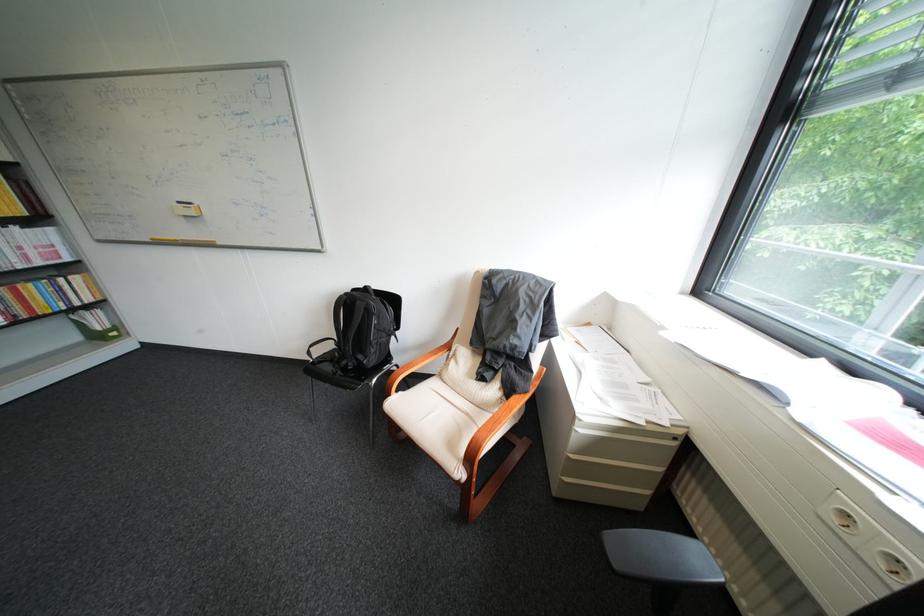
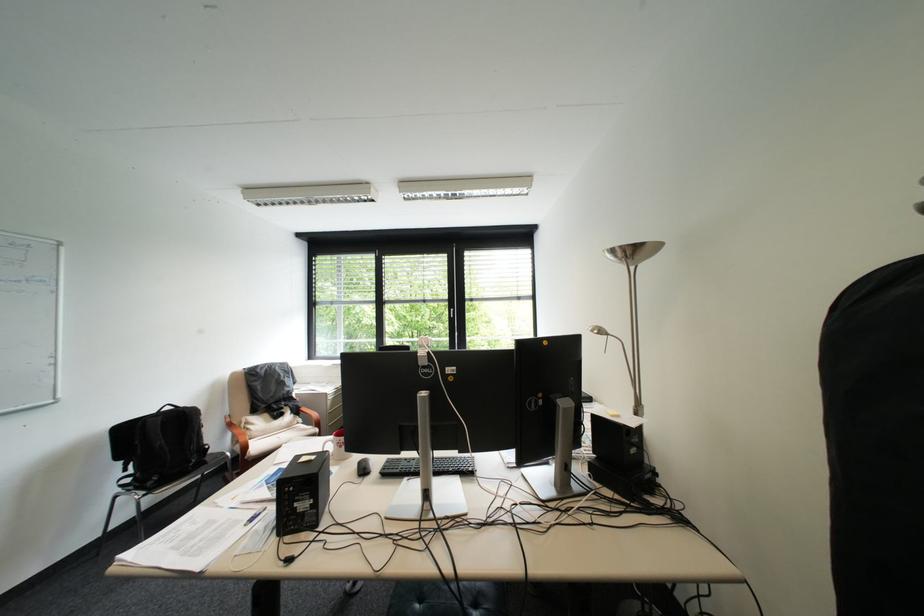
Where in the second image is the point corresponding to [464,354] from the first image?

(256, 424)